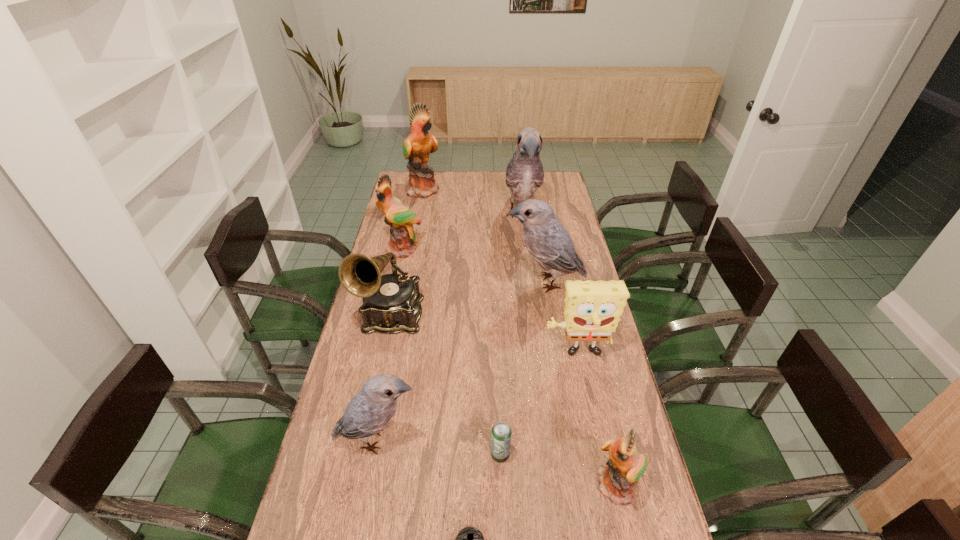
At what (x,y) coordinates should I click in order to perform the action: click on free space that is in between the farthest green parrot and the biggest gray parrot. Please return your answer as a coordinate pair (x, y). The width and height of the screenshot is (960, 540). Looking at the image, I should click on (473, 202).

Image resolution: width=960 pixels, height=540 pixels. In order to click on free space between the third nearest parrot and the second smallest green parrot in this screenshot , I will do `click(474, 266)`.

Locate an element on the screen. empty location between the beer can and the sponge is located at coordinates (539, 404).

The height and width of the screenshot is (540, 960). In order to click on empty space between the leftmost gray parrot and the second biggest green parrot in this screenshot , I will do `click(390, 345)`.

Locate an element on the screen. This screenshot has width=960, height=540. vacant area that lies between the beer can and the nearest parrot is located at coordinates (559, 471).

Locate an element on the screen. unoccupied position between the ninth tallest object and the smallest gray parrot is located at coordinates (439, 447).

The height and width of the screenshot is (540, 960). In order to click on vacant space that's between the second biggest green parrot and the yellow sponge in this screenshot , I will do `click(490, 302)`.

Select which object is the third closest to the farthest gray parrot. Please provide its 2D coordinates. Your answer should be formatted as a tuple, i.e. [(x, y)], where the tuple contains the x and y coordinates of a point satisfying the conditions above.

[(402, 241)]

The height and width of the screenshot is (540, 960). I want to click on object that is the seventh closest one to the phonograph record, so click(470, 539).

Image resolution: width=960 pixels, height=540 pixels. I want to click on parrot that is the fourth closest to the control, so click(x=402, y=241).